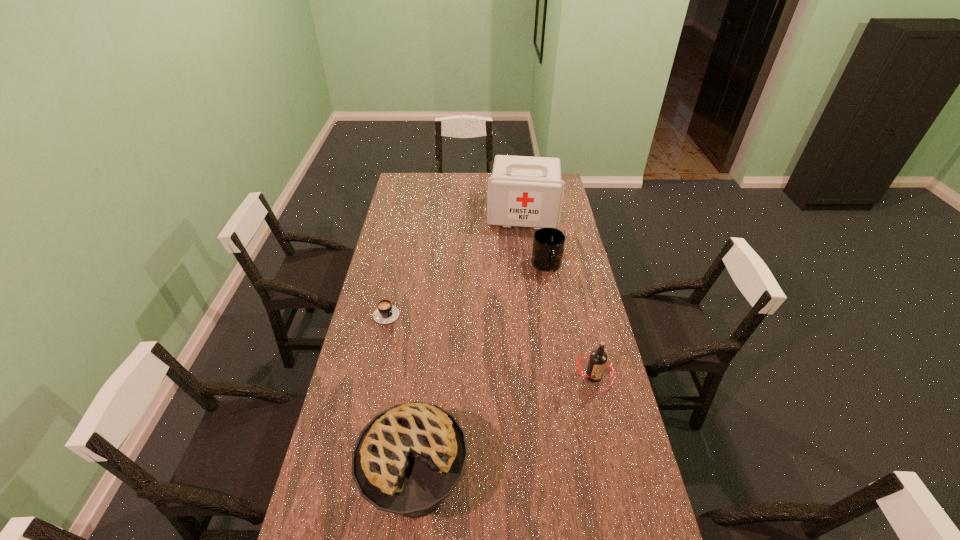
Where is `mug that is at the right edge`? Image resolution: width=960 pixels, height=540 pixels. mug that is at the right edge is located at coordinates (548, 244).

Where is `the first-aid kit that is at the right edge`? This screenshot has height=540, width=960. the first-aid kit that is at the right edge is located at coordinates (523, 191).

In order to click on vacant region at the far edge of the desktop in this screenshot , I will do `click(446, 191)`.

Identify the location of free location at the left edge of the desktop. This screenshot has width=960, height=540. (396, 294).

Where is `vacant area at the right edge`? vacant area at the right edge is located at coordinates (582, 323).

Where is `free spot at the far left corner of the desktop`? This screenshot has height=540, width=960. free spot at the far left corner of the desktop is located at coordinates (421, 173).

The width and height of the screenshot is (960, 540). Identify the location of free space at the near left corner. (348, 526).

Where is `free space between the cappuccino and the root beer`? free space between the cappuccino and the root beer is located at coordinates (491, 344).

This screenshot has width=960, height=540. I want to click on unoccupied area between the mug and the second nearest object, so click(570, 321).

The image size is (960, 540). Find the location of `unoccupied position between the root beer and the first-aid kit`. unoccupied position between the root beer and the first-aid kit is located at coordinates (558, 295).